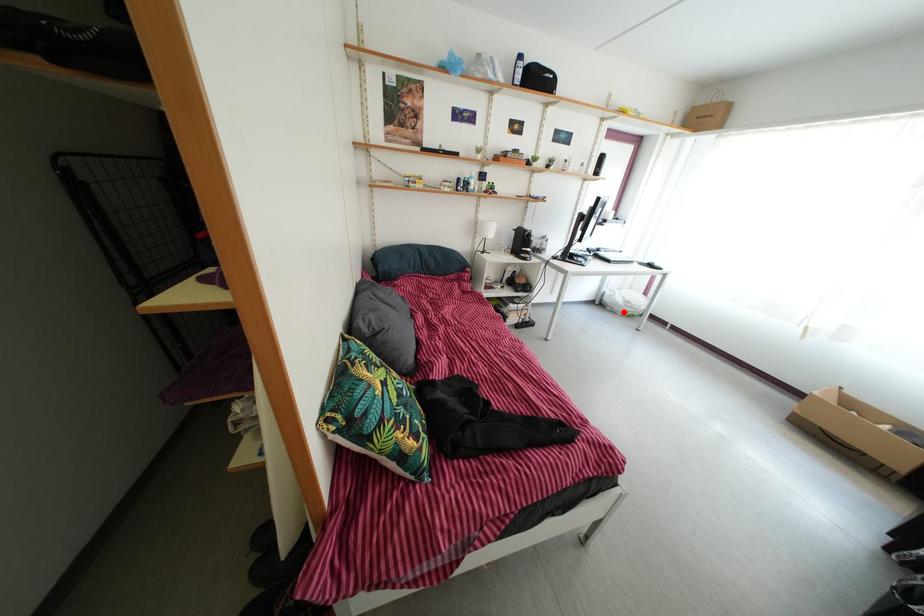
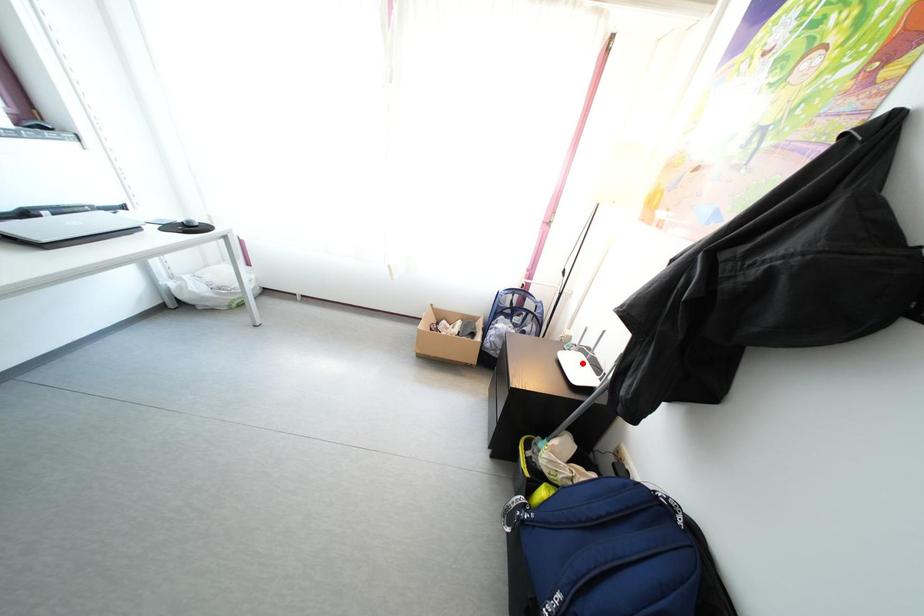
I am providing you with two images of the same scene from different viewpoints. A red point is marked on the first image and another point is marked on the second image. Is the marked point in image1 the same physical position as the marked point in image2?

No